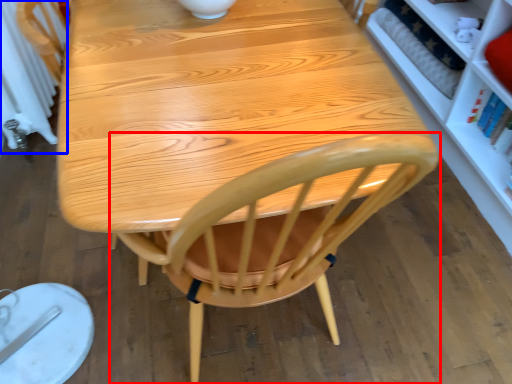
Question: Which of the following is the closest to the observer, chair (highlighted by a red box) or radiator (highlighted by a blue box)?

Choices:
 (A) chair
 (B) radiator

Answer: (A)